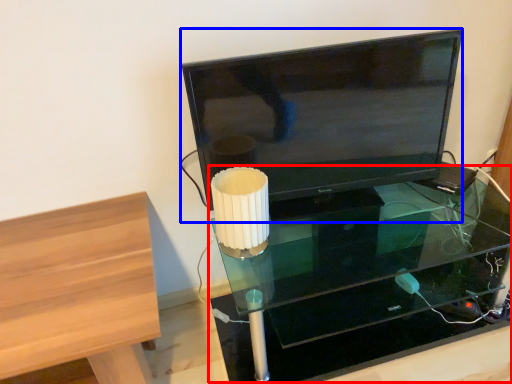
Question: Which object appears closest to the camera in this image, table (highlighted by a red box) or television (highlighted by a blue box)?

Choices:
 (A) table
 (B) television

Answer: (A)